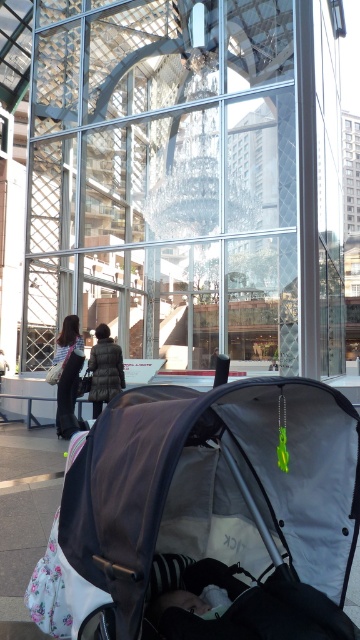
Question: Considering the real-world distances, which object is closest to the dark gray down jacket at center?

Choices:
 (A) transparent glass mall at center
 (B) striped fabric dress at center
 (C) dark gray fabric baby carriage at lower left

Answer: (B)

Question: Which point is farther to the camera?

Choices:
 (A) (135, 236)
 (B) (52, 360)
 (C) (347, 445)
 (D) (106, 381)

Answer: (A)

Question: Can you confirm if dark gray fabric baby carriage at lower left is wider than dark gray down jacket at center?

Choices:
 (A) no
 (B) yes

Answer: (B)

Question: Is dark gray down jacket at center wider than striped fabric dress at center?

Choices:
 (A) yes
 (B) no

Answer: (B)

Question: Which of the following is the farthest from the observer?

Choices:
 (A) dark gray down jacket at center
 (B) striped fabric dress at center
 (C) dark gray fabric baby carriage at lower left

Answer: (B)

Question: Is transparent glass mall at center bigger than dark gray down jacket at center?

Choices:
 (A) yes
 (B) no

Answer: (A)